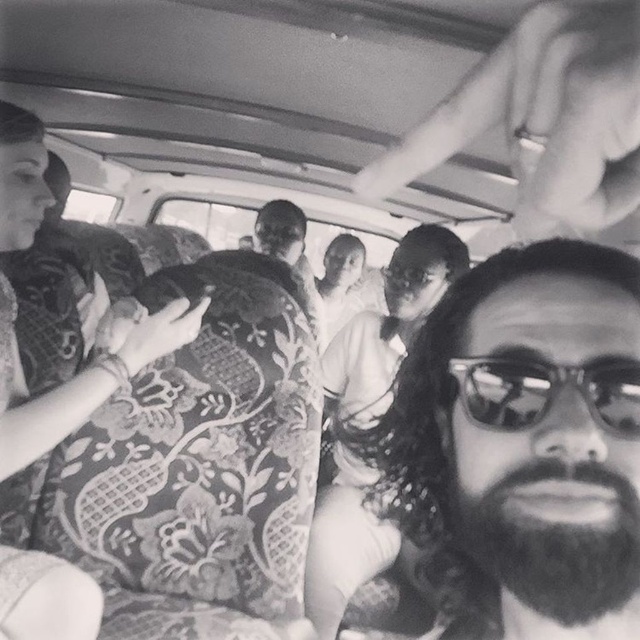
You are a photographer trying to capture a closeup of the bearded man at center and the sunglasses at center in this black and white photo. Based on their positions, can you fit both subjects into a single frame without moving either of them?

The distance between the bearded man at center and the sunglasses at center is 10.02 centimeters, so yes, you can fit both subjects into a single frame since they are positioned close enough to each other.

You are a passenger in the vehicle and want to ask the bearded man at center and the dark brown thick beard at lower right a question. Which one is closer to your left side?

The bearded man at center is to the left of the dark brown thick beard at lower right, so the bearded man at center is closer to your left side.

You are a photographer trying to capture a portrait of the dark brown thick beard at lower right and the sunglasses at center. Which object would require a wider lens to capture in full frame?

The sunglasses at center would require a wider lens because the dark brown thick beard at lower right is thinner than the sunglasses at center.